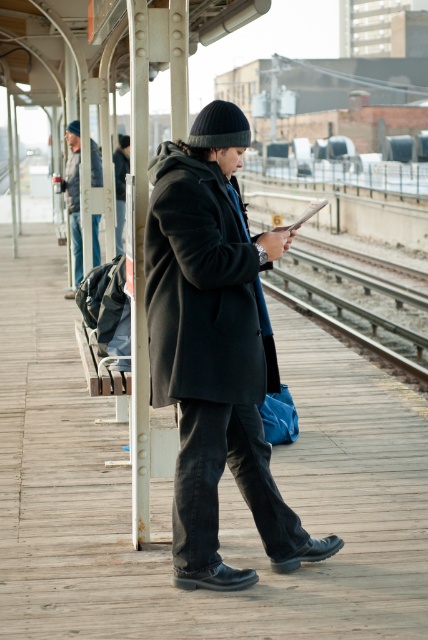
Question: Can you confirm if metal train track at center is positioned below dark gray woolen jacket at left?

Choices:
 (A) no
 (B) yes

Answer: (B)

Question: Which of the following is the closest to the observer?

Choices:
 (A) matte black coat at center
 (B) black wool coat at center

Answer: (A)

Question: Can you confirm if black wool coat at center is positioned above metal train track at center?

Choices:
 (A) yes
 (B) no

Answer: (A)

Question: Which of the following is the farthest from the observer?

Choices:
 (A) dark gray woolen jacket at left
 (B) dark gray wool coat at center
 (C) matte black coat at center
 (D) metal train track at center

Answer: (B)

Question: Considering the relative positions of matte black coat at center and dark gray wool coat at center in the image provided, where is matte black coat at center located with respect to dark gray wool coat at center?

Choices:
 (A) right
 (B) left

Answer: (A)

Question: Estimate the real-world distances between objects in this image. Which object is farther from the metal train track at center?

Choices:
 (A) dark gray woolen jacket at left
 (B) dark gray wool coat at center
 (C) black wool coat at center
 (D) matte black coat at center

Answer: (C)